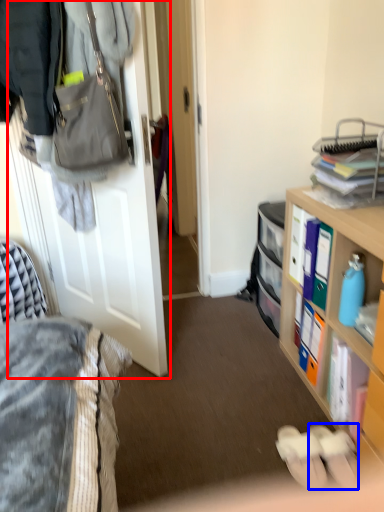
Question: Which object appears closest to the camera in this image, door (highlighted by a red box) or footwear (highlighted by a blue box)?

Choices:
 (A) door
 (B) footwear

Answer: (A)